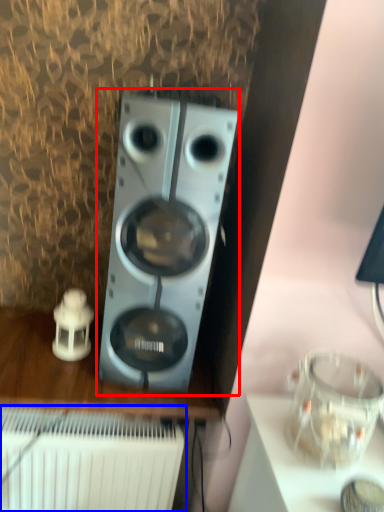
Question: Which object appears closest to the camera in this image, home appliance (highlighted by a red box) or radiator (highlighted by a blue box)?

Choices:
 (A) home appliance
 (B) radiator

Answer: (A)